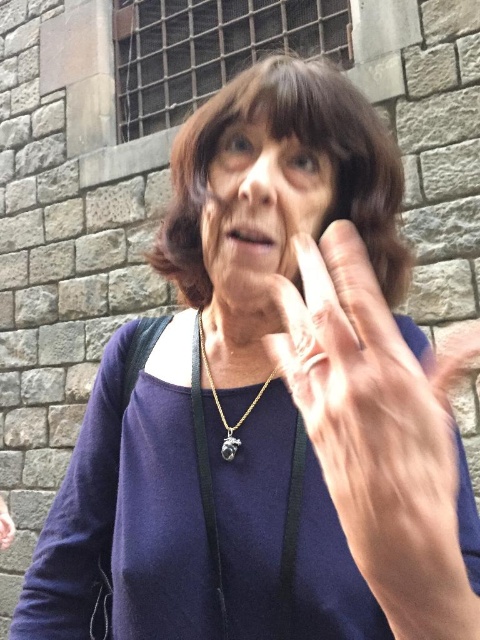
Question: Considering the real-world distances, which object is farthest from the gold metallic pendant at center?

Choices:
 (A) smooth skin face at center
 (B) pale skin/soft flesh hand at center

Answer: (B)

Question: Is smooth skin face at center smaller than gold metallic pendant at center?

Choices:
 (A) no
 (B) yes

Answer: (A)

Question: Which of the following is the farthest from the observer?

Choices:
 (A) smooth skin face at center
 (B) gold metallic pendant at center
 (C) pale skin/soft flesh hand at center

Answer: (B)

Question: Considering the relative positions of pale skin/soft flesh hand at center and gold metallic pendant at center in the image provided, where is pale skin/soft flesh hand at center located with respect to gold metallic pendant at center?

Choices:
 (A) above
 (B) below

Answer: (B)

Question: Does smooth skin face at center have a smaller size compared to gold metallic pendant at center?

Choices:
 (A) yes
 (B) no

Answer: (B)

Question: Which object appears farthest from the camera in this image?

Choices:
 (A) pale skin/soft flesh hand at center
 (B) smooth skin face at center
 (C) gold metallic pendant at center

Answer: (C)